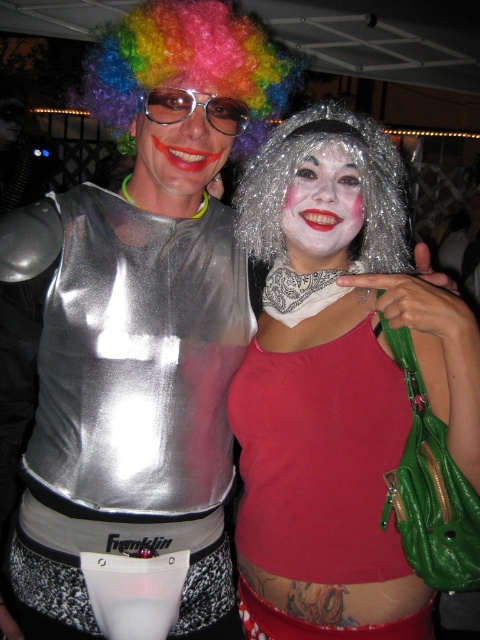
Who is higher up, matte red tank top at center or rainbow curly wig at upper left?

Positioned higher is rainbow curly wig at upper left.

Who is more distant from viewer, (337, 589) or (186, 81)?

Point (337, 589)

Find the location of a particular element. The image size is (480, 640). matte red tank top at center is located at coordinates (348, 397).

Can you confirm if shiny metallic vest at left is bigger than shiny metallic wig at center?

No.

Is shiny metallic vest at left wider than shiny metallic wig at center?

Indeed, shiny metallic vest at left has a greater width compared to shiny metallic wig at center.

Does point (170, 499) come farther from viewer compared to point (392, 154)?

No, (170, 499) is closer to viewer.

Where is `shiny metallic vest at left`? The image size is (480, 640). shiny metallic vest at left is located at coordinates (123, 401).

Which is below, shiny metallic wig at center or matte plastic face at center?

shiny metallic wig at center is lower down.

Can you confirm if shiny metallic wig at center is positioned above matte plastic face at center?

Actually, shiny metallic wig at center is below matte plastic face at center.

Based on the photo, measure the distance between shiny metallic wig at center and camera.

shiny metallic wig at center and camera are 1.08 meters apart.

What are the coordinates of `shiny metallic wig at center` in the screenshot? It's located at (360, 186).